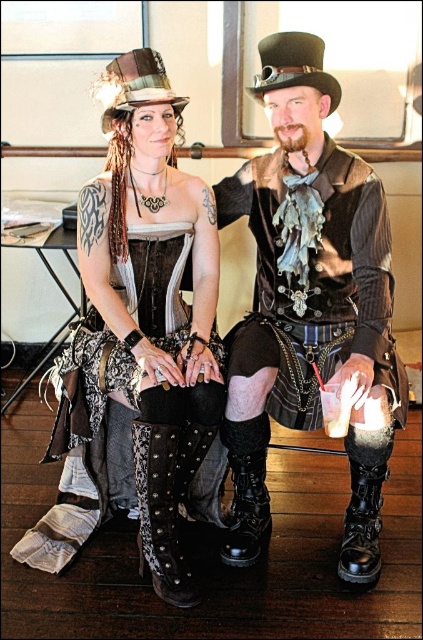
You are taking a photo of the two points in the image. Which point, point (x=310, y=310) or point (x=195, y=465), will appear larger in your photo?

Point (x=310, y=310) is closer to the camera than point (x=195, y=465), so it will appear larger in the photo.

You are a photographer setting up a shoot in the scene. You need to place a small prop between the suede studded boot at lower center and the black leather boot at lower right. Based on their positions, which boot will the prop be closer to?

The prop will be closer to the suede studded boot at lower center because it is closer to the viewer than the black leather boot at lower right.

You are organizing a steampunk costume contest and need to ensure all footwear fits through a 1.2 meter wide entrance. Given the leather boots at center and the black leather boot at lower right, which pair is wider and thus might require more caution when moving through narrow spaces?

The leather boots at center are wider than the black leather boot at lower right, so they might require more caution when moving through narrow spaces like the 1.2 meter entrance.